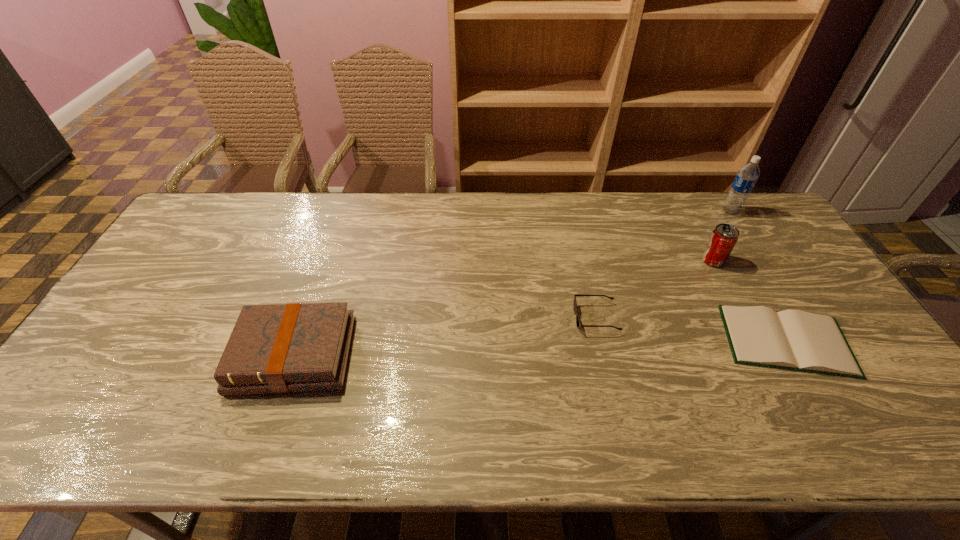
Identify the location of the tallest object. The height and width of the screenshot is (540, 960). (746, 178).

At what (x,y) coordinates should I click in order to perform the action: click on the farthest object. Please return your answer as a coordinate pair (x, y). Looking at the image, I should click on (746, 178).

Locate an element on the screen. This screenshot has width=960, height=540. pop soda is located at coordinates (723, 238).

The height and width of the screenshot is (540, 960). Find the location of `the fourth shortest object`. the fourth shortest object is located at coordinates (723, 238).

Locate an element on the screen. the third tallest object is located at coordinates (281, 348).

This screenshot has width=960, height=540. What are the coordinates of `the left hardback book` in the screenshot? It's located at (281, 348).

In order to click on the fourth object from right to left in this screenshot , I will do point(578,323).

Where is `sunglasses`? This screenshot has height=540, width=960. sunglasses is located at coordinates (578, 323).

Find the location of a particular element. the shorter hardback book is located at coordinates (796, 340).

In order to click on the shortest object in this screenshot , I will do `click(796, 340)`.